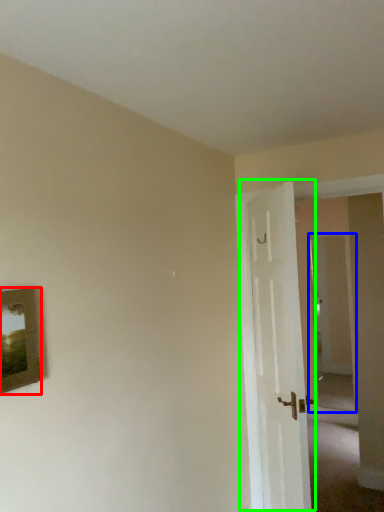
Question: Which object is the closest to the picture frame (highlighted by a red box)? Choose among these: glass door (highlighted by a blue box) or door (highlighted by a green box).

Choices:
 (A) glass door
 (B) door

Answer: (B)